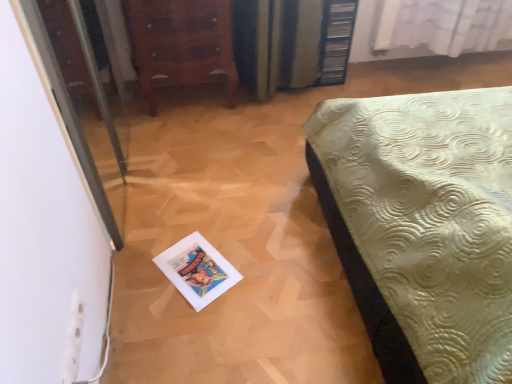
Where is `white sheer curtain at upper right`? Image resolution: width=512 pixels, height=384 pixels. white sheer curtain at upper right is located at coordinates (445, 25).

What do you see at coordinates (81, 102) in the screenshot?
I see `transparent glass screen door at left` at bounding box center [81, 102].

Identify the location of white sheer curtain at upper right. Image resolution: width=512 pixels, height=384 pixels. (445, 25).

How different are the orientations of transparent glass screen door at left and white sheer curtain at upper right in degrees?

The facing directions of transparent glass screen door at left and white sheer curtain at upper right are 89.3 degrees apart.

From the picture: Is transparent glass screen door at left spatially inside white sheer curtain at upper right, or outside of it?

transparent glass screen door at left exists outside the volume of white sheer curtain at upper right.

Considering the positions of point (61, 48) and point (451, 44), is point (61, 48) closer or farther from the camera than point (451, 44)?

Clearly, point (61, 48) is closer to the camera than point (451, 44).

Which is in front, point (200, 44) or point (71, 29)?

Positioned in front is point (71, 29).

From a real-world perspective, is wooden chest of drawers at upper left physically above transparent glass screen door at left?

Actually, wooden chest of drawers at upper left is physically below transparent glass screen door at left in the real world.

In the scene shown: Which of these two, wooden chest of drawers at upper left or transparent glass screen door at left, stands shorter?

wooden chest of drawers at upper left.

Is wooden chest of drawers at upper left facing away from transparent glass screen door at left?

No, transparent glass screen door at left is not at the back of wooden chest of drawers at upper left.

Consider the image. Measure the distance from wooden chest of drawers at upper left to white sheer curtain at upper right.

1.16 meters.

Who is bigger, wooden chest of drawers at upper left or white sheer curtain at upper right?

With larger size is wooden chest of drawers at upper left.

Is wooden chest of drawers at upper left shorter than white sheer curtain at upper right?

In fact, wooden chest of drawers at upper left may be taller than white sheer curtain at upper right.

From the image's perspective, which one is positioned higher, wooden chest of drawers at upper left or white sheer curtain at upper right?

white sheer curtain at upper right.

Is white sheer curtain at upper right shorter than wooden chest of drawers at upper left?

Correct, white sheer curtain at upper right is not as tall as wooden chest of drawers at upper left.

Considering the relative positions of white sheer curtain at upper right and wooden chest of drawers at upper left in the image provided, is white sheer curtain at upper right in front of wooden chest of drawers at upper left?

No, white sheer curtain at upper right is further to the viewer.

Which is behind, point (398, 32) or point (203, 36)?

The point (398, 32) is farther.

Could you tell me if white sheer curtain at upper right is turned towards wooden chest of drawers at upper left?

No, white sheer curtain at upper right is not turned towards wooden chest of drawers at upper left.

From the image's perspective, is transparent glass screen door at left located above wooden chest of drawers at upper left?

Actually, transparent glass screen door at left appears below wooden chest of drawers at upper left in the image.

The height and width of the screenshot is (384, 512). In order to click on screen door in front of the wooden chest of drawers at upper left in this screenshot , I will do `click(81, 102)`.

How much distance is there between transparent glass screen door at left and wooden chest of drawers at upper left?

22.21 inches.

Is transparent glass screen door at left located outside wooden chest of drawers at upper left?

Absolutely, transparent glass screen door at left is external to wooden chest of drawers at upper left.

Choose the correct answer: Is white sheer curtain at upper right inside transparent glass screen door at left or outside it?

white sheer curtain at upper right is not enclosed by transparent glass screen door at left.

Is white sheer curtain at upper right smaller than transparent glass screen door at left?

Indeed, white sheer curtain at upper right has a smaller size compared to transparent glass screen door at left.

Considering the sizes of white sheer curtain at upper right and transparent glass screen door at left in the image, is white sheer curtain at upper right wider or thinner than transparent glass screen door at left?

white sheer curtain at upper right is wider than transparent glass screen door at left.

Is white sheer curtain at upper right turned away from transparent glass screen door at left?

No, white sheer curtain at upper right's orientation is not away from transparent glass screen door at left.

Find the location of a particular element. Image resolution: width=512 pixels, height=384 pixels. screen door in front of the white sheer curtain at upper right is located at coordinates (81, 102).

The width and height of the screenshot is (512, 384). Find the location of `screen door above the wooden chest of drawers at upper left (from a real-world perspective)`. screen door above the wooden chest of drawers at upper left (from a real-world perspective) is located at coordinates (81, 102).

Based on their spatial positions, is wooden chest of drawers at upper left or transparent glass screen door at left further from white sheer curtain at upper right?

transparent glass screen door at left is further to white sheer curtain at upper right.

Estimate the real-world distances between objects in this image. Which object is closer to white sheer curtain at upper right, transparent glass screen door at left or wooden chest of drawers at upper left?

wooden chest of drawers at upper left is closer to white sheer curtain at upper right.

Which object lies further to the anchor point transparent glass screen door at left, wooden chest of drawers at upper left or white sheer curtain at upper right?

white sheer curtain at upper right lies further to transparent glass screen door at left than the other object.

Considering their positions, is transparent glass screen door at left positioned closer to wooden chest of drawers at upper left than white sheer curtain at upper right?

transparent glass screen door at left is closer to wooden chest of drawers at upper left.

From the image, which object appears to be nearer to transparent glass screen door at left, white sheer curtain at upper right or wooden chest of drawers at upper left?

The object closer to transparent glass screen door at left is wooden chest of drawers at upper left.

Considering their positions, is white sheer curtain at upper right positioned closer to wooden chest of drawers at upper left than transparent glass screen door at left?

Among the two, transparent glass screen door at left is located nearer to wooden chest of drawers at upper left.

The image size is (512, 384). Find the location of `furniture between transparent glass screen door at left and white sheer curtain at upper right`. furniture between transparent glass screen door at left and white sheer curtain at upper right is located at coordinates (181, 42).